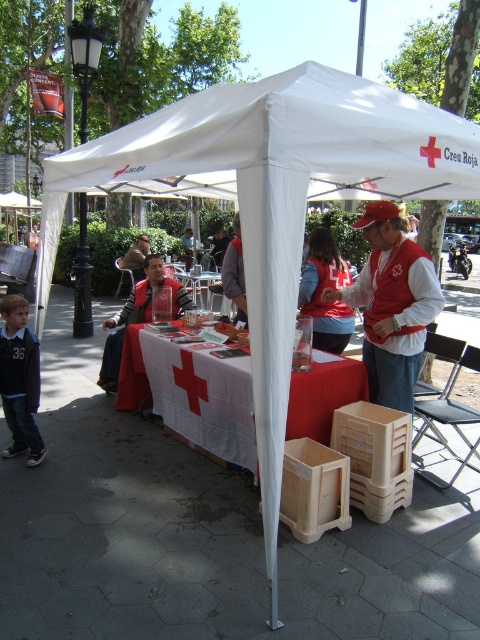
Can you confirm if dark blue jersey at lower left is bigger than red fabric jacket at center?

Indeed, dark blue jersey at lower left has a larger size compared to red fabric jacket at center.

Is dark blue jersey at lower left wider than red fabric jacket at center?

Indeed, dark blue jersey at lower left has a greater width compared to red fabric jacket at center.

Is point (8, 417) closer to camera compared to point (240, 232)?

Yes.

Identify the location of dark blue jersey at lower left. (20, 380).

Between matte red vest at center and matte brown jacket at center, which one has more height?

matte brown jacket at center is taller.

Who is more distant from viewer, (325, 323) or (135, 282)?

Point (135, 282)

Measure the distance between point (326, 349) and camera.

Point (326, 349) is 4.95 meters away from camera.

You are a GUI agent. You are given a task and a screenshot of the screen. Output one action in this format:
    pyautogui.click(x=<x>, y=<y>)
    Task: Click on the matte red vest at center
    The width and height of the screenshot is (480, 640).
    Given the screenshot: What is the action you would take?
    pyautogui.click(x=324, y=289)

Is red fabric jacket at center thinner than matte brown jacket at center?

Correct, red fabric jacket at center's width is less than matte brown jacket at center's.

How far apart are red fabric jacket at center and matte brown jacket at center?

red fabric jacket at center and matte brown jacket at center are 6.36 meters apart.

Where is `red fabric jacket at center`? red fabric jacket at center is located at coordinates (235, 273).

You are a GUI agent. You are given a task and a screenshot of the screen. Output one action in this format:
    pyautogui.click(x=<x>, y=<y>)
    Task: Click on the red fabric jacket at center
    
    Given the screenshot: What is the action you would take?
    pyautogui.click(x=235, y=273)